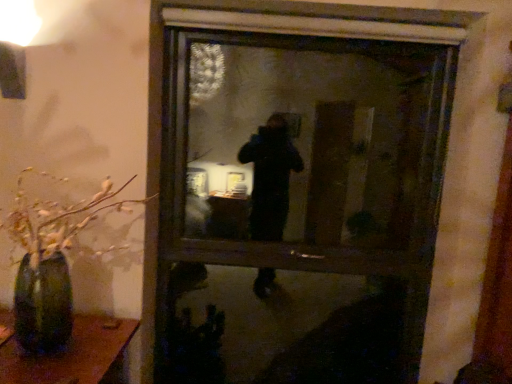
Question: Considering the relative positions of green matte vase at left and transparent glass window at center in the image provided, is green matte vase at left in front of transparent glass window at center?

Choices:
 (A) yes
 (B) no

Answer: (A)

Question: Is green matte vase at left behind transparent glass window at center?

Choices:
 (A) yes
 (B) no

Answer: (B)

Question: Considering the relative sizes of green matte vase at left and transparent glass window at center in the image provided, is green matte vase at left taller than transparent glass window at center?

Choices:
 (A) yes
 (B) no

Answer: (B)

Question: Would you say green matte vase at left contains transparent glass window at center?

Choices:
 (A) yes
 (B) no

Answer: (B)

Question: Considering the relative positions of green matte vase at left and transparent glass window at center in the image provided, is green matte vase at left to the right of transparent glass window at center from the viewer's perspective?

Choices:
 (A) no
 (B) yes

Answer: (A)

Question: Does green matte vase at left have a greater width compared to transparent glass window at center?

Choices:
 (A) yes
 (B) no

Answer: (A)

Question: Considering the relative sizes of transparent glass window at center and green matte vase at left in the image provided, is transparent glass window at center taller than green matte vase at left?

Choices:
 (A) yes
 (B) no

Answer: (A)

Question: Can green matte vase at left be found inside transparent glass window at center?

Choices:
 (A) yes
 (B) no

Answer: (B)

Question: Is transparent glass window at center to the right of green matte vase at left from the viewer's perspective?

Choices:
 (A) no
 (B) yes

Answer: (B)

Question: From the image's perspective, does transparent glass window at center appear higher than green matte vase at left?

Choices:
 (A) no
 (B) yes

Answer: (B)

Question: Considering the relative positions of transparent glass window at center and green matte vase at left in the image provided, is transparent glass window at center to the left of green matte vase at left from the viewer's perspective?

Choices:
 (A) yes
 (B) no

Answer: (B)

Question: From the image's perspective, is transparent glass window at center under green matte vase at left?

Choices:
 (A) no
 (B) yes

Answer: (A)

Question: Is green matte vase at left to the left or to the right of transparent glass window at center in the image?

Choices:
 (A) left
 (B) right

Answer: (A)